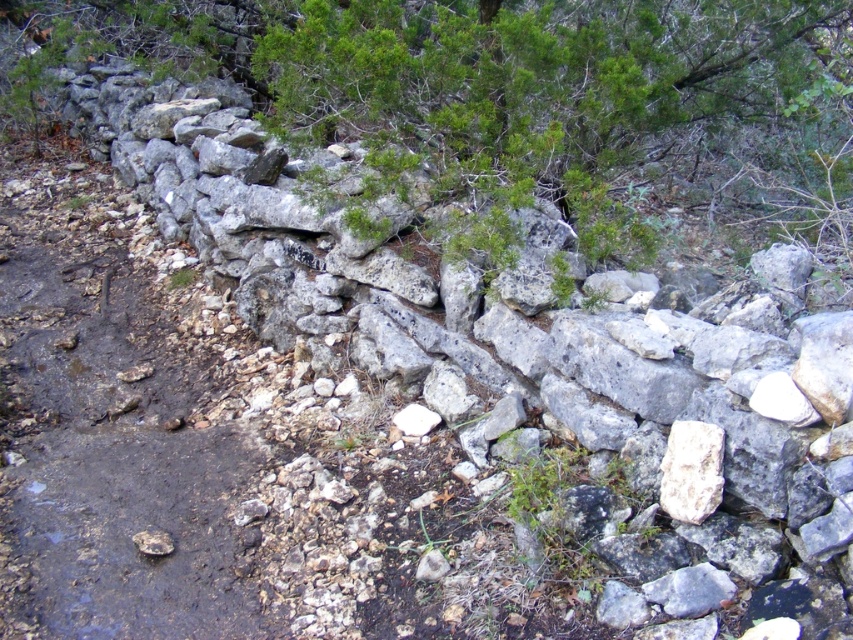
Who is more forward, (x=498, y=84) or (x=53, y=323)?

Point (x=498, y=84) is in front.

In the scene shown: Measure the distance from green leafy tree at upper center to dull gray dirt track at center.

green leafy tree at upper center and dull gray dirt track at center are 5.65 feet apart from each other.

Which is behind, point (235, 20) or point (103, 266)?

The point (235, 20) is behind.

At what (x,y) coordinates should I click in order to perform the action: click on green leafy tree at upper center. Please return your answer as a coordinate pair (x, y). The height and width of the screenshot is (640, 853). Looking at the image, I should click on (515, 92).

Between green leafy tree at upper center and white rough rock at center, which one appears on the left side from the viewer's perspective?

From the viewer's perspective, white rough rock at center appears more on the left side.

Can you confirm if green leafy tree at upper center is wider than white rough rock at center?

Yes.

The image size is (853, 640). Describe the element at coordinates (515, 92) in the screenshot. I see `green leafy tree at upper center` at that location.

I want to click on green leafy tree at upper center, so click(515, 92).

Who is positioned more to the right, dull gray dirt track at center or white rough rock at center?

Positioned to the right is white rough rock at center.

Between point (53, 376) and point (698, 448), which one is positioned behind?

Point (53, 376)

Locate an element on the screen. This screenshot has height=640, width=853. dull gray dirt track at center is located at coordinates (108, 435).